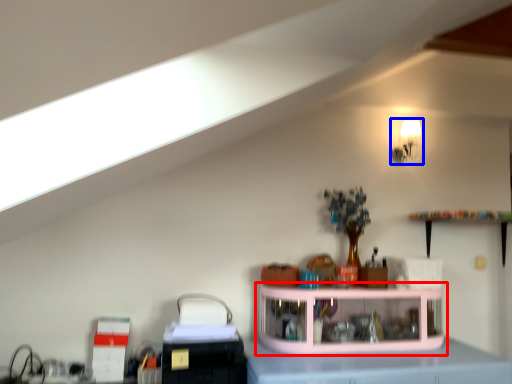
Question: Which object is closer to the camera taking this photo, shelf (highlighted by a red box) or light fixture (highlighted by a blue box)?

Choices:
 (A) shelf
 (B) light fixture

Answer: (A)